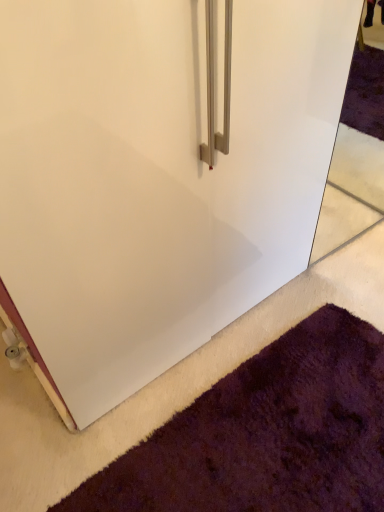
This screenshot has height=512, width=384. What do you see at coordinates (266, 434) in the screenshot?
I see `purple shaggy carpet at lower right` at bounding box center [266, 434].

Identify the location of purple shaggy carpet at lower right. The image size is (384, 512). (266, 434).

The height and width of the screenshot is (512, 384). In order to click on purple shaggy carpet at lower right in this screenshot , I will do [x=266, y=434].